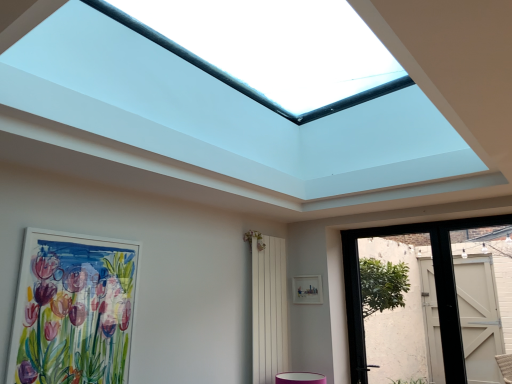
Question: Considering the positions of point (354, 304) and point (31, 342), is point (354, 304) closer or farther from the camera than point (31, 342)?

Choices:
 (A) farther
 (B) closer

Answer: (A)

Question: Is matte black door at right, the 2th door viewed from the right, to the left or to the right of matte white picture frame at left, the 1th picture frame from the left, in the image?

Choices:
 (A) right
 (B) left

Answer: (A)

Question: Considering the real-world distances, which object is farthest from the pink fabric flower at center?

Choices:
 (A) white matte picture frame at center, the second picture frame positioned from the front
 (B) matte white picture frame at left, placed as the 1th picture frame when sorted from front to back
 (C) white painted wood door at right, which is counted as the second door, starting from the left
 (D) white wooden screen door at center
 (E) matte black door at right, the first door positioned from the left

Answer: (C)

Question: Estimate the real-world distances between objects in this image. Which object is farther from the matte black door at right, the first door positioned from the left?

Choices:
 (A) pink fabric flower at center
 (B) white matte picture frame at center, the second picture frame positioned from the front
 (C) white painted wood door at right, which is counted as the second door, starting from the left
 (D) matte white picture frame at left, placed as the 1th picture frame when sorted from front to back
 (E) white wooden screen door at center

Answer: (D)